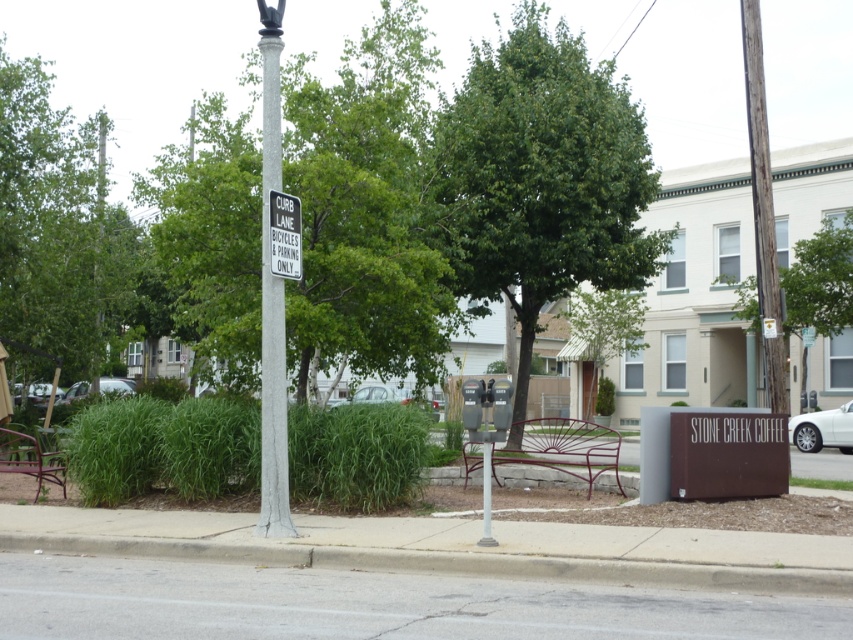
Question: Which point is closer to the camera taking this photo?

Choices:
 (A) click(109, 378)
 (B) click(590, 474)
 (C) click(271, 259)

Answer: (C)

Question: Does gray concrete curb at lower center appear over white glossy sedan at right?

Choices:
 (A) no
 (B) yes

Answer: (B)

Question: Is brown wooden pole at upper right below white plastic sign at upper center?

Choices:
 (A) no
 (B) yes

Answer: (A)

Question: Is metallic red park bench at lower left further to camera compared to metallic silver car at lower left?

Choices:
 (A) no
 (B) yes

Answer: (A)

Question: Which of the following is the closest to the observer?

Choices:
 (A) shiny silver car at lower left
 (B) metallic purple park bench at center

Answer: (B)

Question: Among these points, which one is farthest from the camera?

Choices:
 (A) (824, 432)
 (B) (518, 564)

Answer: (A)